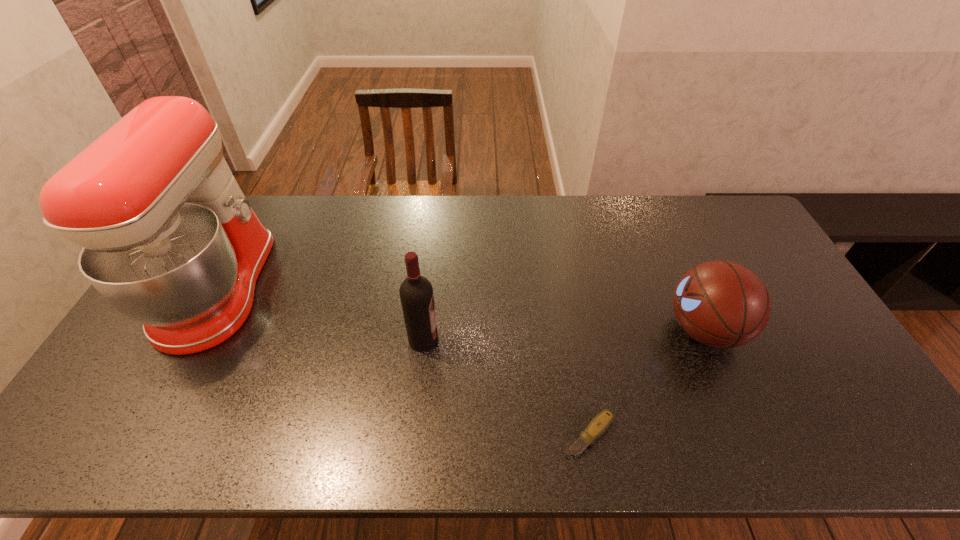
Image resolution: width=960 pixels, height=540 pixels. Find the location of `mixer`. mixer is located at coordinates (169, 240).

Find the location of `the leftmost object`. the leftmost object is located at coordinates tap(169, 240).

Locate an element on the screen. This screenshot has width=960, height=540. wine bottle is located at coordinates (416, 292).

Where is `the third shortest object`? This screenshot has width=960, height=540. the third shortest object is located at coordinates (416, 292).

Identify the location of the rightmost object. (721, 304).

Find the location of a particular element. the second shortest object is located at coordinates [721, 304].

Image resolution: width=960 pixels, height=540 pixels. Identify the location of pocketknife. (600, 423).

Image resolution: width=960 pixels, height=540 pixels. In order to click on the shortest object in this screenshot , I will do `click(600, 423)`.

The height and width of the screenshot is (540, 960). Find the location of `vacant space located on the front-facing side of the leftmost object`. vacant space located on the front-facing side of the leftmost object is located at coordinates (303, 288).

Locate an element on the screen. This screenshot has width=960, height=540. vacant region located 0.180m on the label of the third shortest object is located at coordinates (503, 340).